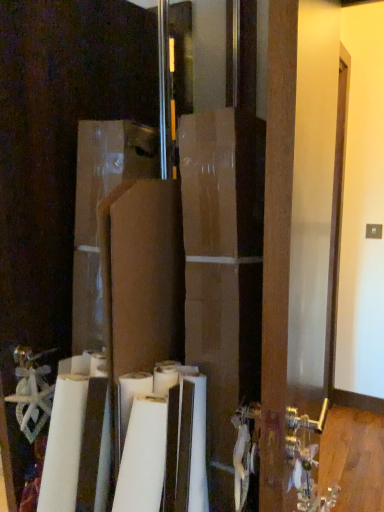
The width and height of the screenshot is (384, 512). Describe the element at coordinates (296, 222) in the screenshot. I see `wooden door at center` at that location.

Identify the location of wooden door at center. (296, 222).

Image resolution: width=384 pixels, height=512 pixels. In order to click on wooden door at center in this screenshot , I will do `click(296, 222)`.